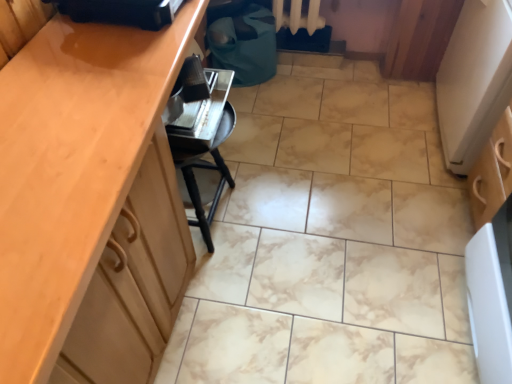
Locate an element on the screen. free space in front of black plastic bag at upper center, acting as the second appliance starting from the back is located at coordinates (99, 76).